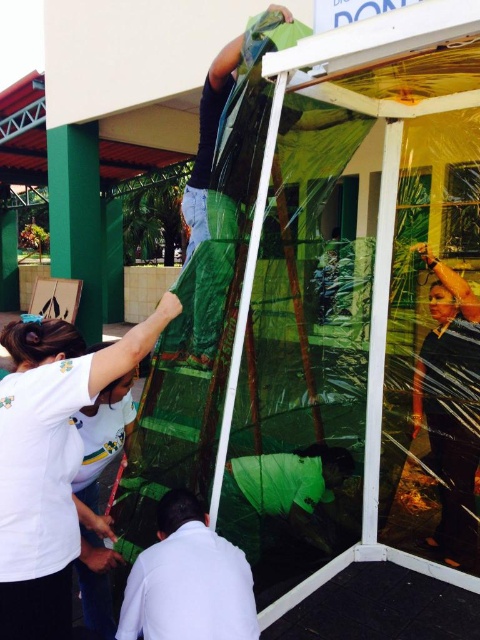
Question: Which is nearer to the white matte shirt at upper left?

Choices:
 (A) white matte shirt at lower center
 (B) shiny black hair at center

Answer: (A)

Question: Is shiny black hair at center closer to the viewer compared to white matte shirt at lower center?

Choices:
 (A) yes
 (B) no

Answer: (B)

Question: Is white matte shirt at upper left below white matte shirt at lower center?

Choices:
 (A) no
 (B) yes

Answer: (A)

Question: Which of the following is the closest to the observer?

Choices:
 (A) white matte shirt at lower center
 (B) shiny black hair at center
 (C) white matte shirt at upper left

Answer: (C)

Question: Does shiny black hair at center come behind white matte shirt at lower center?

Choices:
 (A) no
 (B) yes

Answer: (B)

Question: Which object is farther from the camera taking this photo?

Choices:
 (A) white matte shirt at upper left
 (B) white matte shirt at lower center
 (C) shiny black hair at center

Answer: (C)